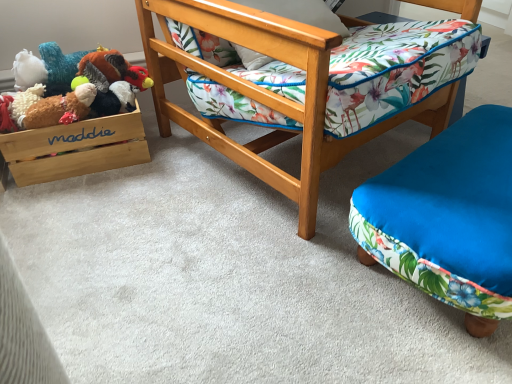
Find the location of a particular element. vacant area that lies to the right of wooden/matte storage box at left is located at coordinates (186, 167).